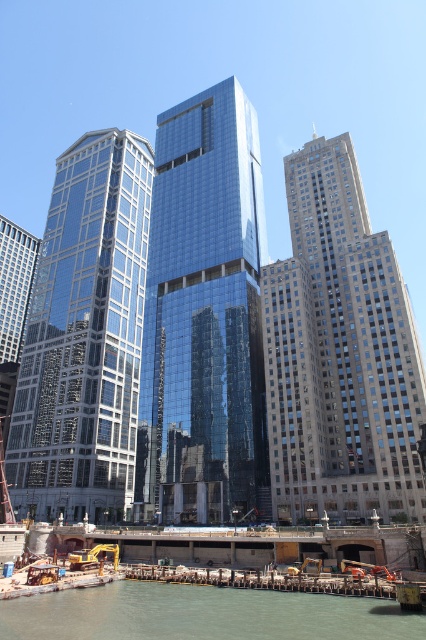
Does gray stone skyscraper at right lie in front of greenish water at lower center?

No, gray stone skyscraper at right is further to the viewer.

Is gray stone skyscraper at right positioned at the back of greenish water at lower center?

Yes, it is.

What do you see at coordinates (339, 353) in the screenshot?
I see `gray stone skyscraper at right` at bounding box center [339, 353].

What are the coordinates of `gray stone skyscraper at right` in the screenshot? It's located at (339, 353).

Can you confirm if glossy glass skyscraper at center is positioned below shiny glass skyscraper at left?

No.

Who is lower down, glossy glass skyscraper at center or shiny glass skyscraper at left?

Positioned lower is shiny glass skyscraper at left.

Is point (235, 266) closer to camera compared to point (129, 304)?

Yes, it is.

This screenshot has height=640, width=426. In order to click on glossy glass skyscraper at center in this screenshot , I will do `click(204, 307)`.

Does glossy glass skyscraper at center appear on the right side of greenish water at lower center?

Incorrect, glossy glass skyscraper at center is not on the right side of greenish water at lower center.

Does glossy glass skyscraper at center come in front of greenish water at lower center?

No, glossy glass skyscraper at center is further to the viewer.

Is point (192, 320) closer to camera compared to point (284, 628)?

No, it is not.

Where is `glossy glass skyscraper at center`? glossy glass skyscraper at center is located at coordinates (204, 307).